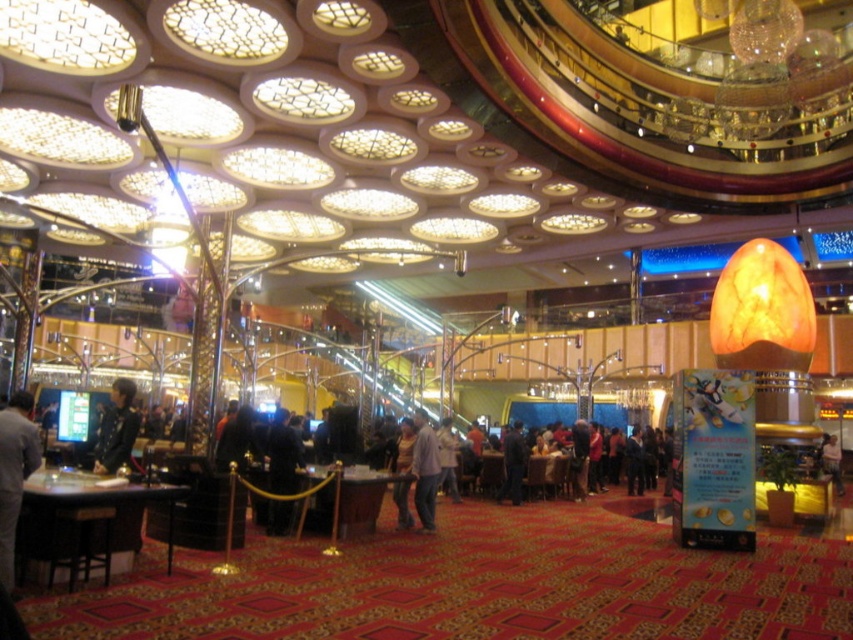
Question: Can you confirm if dark blue fabric jacket at center is thinner than light brown leather jacket at center?

Choices:
 (A) yes
 (B) no

Answer: (A)

Question: Considering the relative positions of gray fabric jacket at lower left and dark blue jacket at left in the image provided, where is gray fabric jacket at lower left located with respect to dark blue jacket at left?

Choices:
 (A) right
 (B) left

Answer: (A)

Question: Estimate the real-world distances between objects in this image. Which object is farther from the light brown fabric shirt at center?

Choices:
 (A) light brown leather jacket at lower right
 (B) dark blue jacket at left
 (C) light brown leather jacket at center
 (D) dark gray fabric jacket at center

Answer: (A)

Question: Is dark blue jacket at left wider than light brown leather jacket at center?

Choices:
 (A) no
 (B) yes

Answer: (B)

Question: Which point appears closest to the camera in this image?

Choices:
 (A) (515, 458)
 (B) (840, 474)
 (C) (132, 438)

Answer: (C)

Question: Which object appears farthest from the camera in this image?

Choices:
 (A) dark blue fabric jacket at center
 (B) dark gray fabric jacket at center
 (C) dark blue jacket at left

Answer: (B)